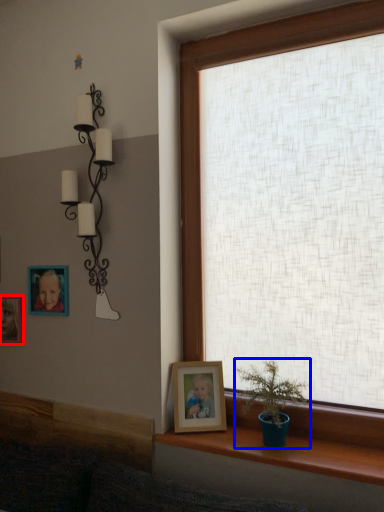
Question: Which of the following is the farthest to the observer, picture frame (highlighted by a red box) or houseplant (highlighted by a blue box)?

Choices:
 (A) picture frame
 (B) houseplant

Answer: (A)